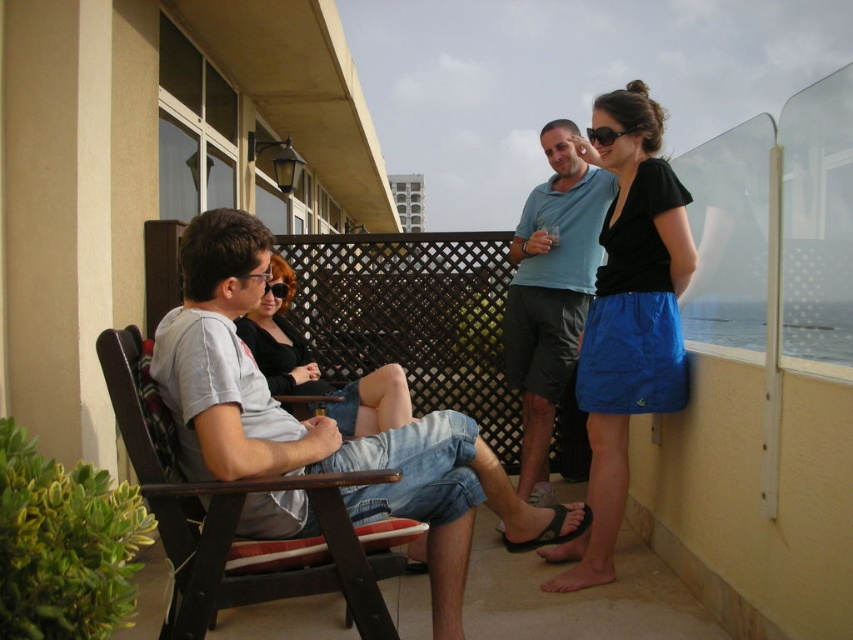
You are a photographer trying to capture a closeup of the matte gray shirt at center and the matte black sunglasses at center. If your camera can only focus on objects within a 10 cm width, will both items fit in the frame?

The matte gray shirt at center might be wider than matte black sunglasses at center, so the total width of both items could exceed 10 cm. It depends on their exact dimensions, but there is a possibility they won not fit within the frame.

You are a photographer trying to capture the scene from the balcony. You notice the matte gray shirt at center and the matte black sunglasses at center. Which object is positioned lower in the image?

The matte gray shirt at center is below matte black sunglasses at center, so the matte gray shirt at center is positioned lower in the image.